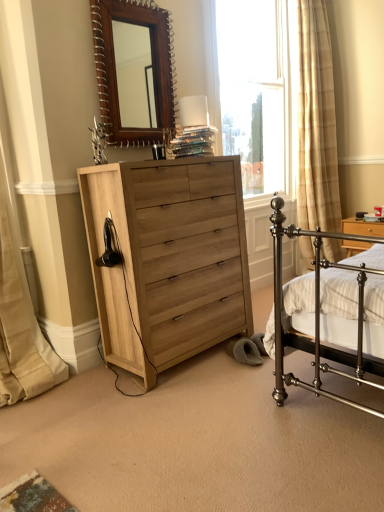
Question: Is wooden mirror at upper center not near beige fabric curtain at left?

Choices:
 (A) no
 (B) yes

Answer: (B)

Question: Considering the relative sizes of wooden mirror at upper center and beige fabric curtain at left in the image provided, is wooden mirror at upper center thinner than beige fabric curtain at left?

Choices:
 (A) no
 (B) yes

Answer: (B)

Question: Is wooden mirror at upper center surrounding beige fabric curtain at left?

Choices:
 (A) yes
 (B) no

Answer: (B)

Question: From a real-world perspective, is wooden mirror at upper center on beige fabric curtain at left?

Choices:
 (A) yes
 (B) no

Answer: (A)

Question: Considering the relative sizes of wooden mirror at upper center and beige fabric curtain at left in the image provided, is wooden mirror at upper center wider than beige fabric curtain at left?

Choices:
 (A) yes
 (B) no

Answer: (B)

Question: In the image, is wooden mirror at upper center positioned in front of or behind beige fabric curtain at left?

Choices:
 (A) behind
 (B) front

Answer: (A)

Question: In terms of size, does wooden mirror at upper center appear bigger or smaller than beige fabric curtain at left?

Choices:
 (A) big
 (B) small

Answer: (B)

Question: From the image's perspective, is wooden mirror at upper center above or below beige fabric curtain at left?

Choices:
 (A) below
 (B) above

Answer: (B)

Question: Looking at their shapes, would you say wooden mirror at upper center is wider or thinner than beige fabric curtain at left?

Choices:
 (A) wide
 (B) thin

Answer: (B)

Question: Does point (34, 343) appear closer or farther from the camera than point (104, 90)?

Choices:
 (A) farther
 (B) closer

Answer: (A)

Question: Is beige fabric curtain at left situated inside wooden mirror at upper center or outside?

Choices:
 (A) inside
 (B) outside

Answer: (B)

Question: From the image's perspective, is beige fabric curtain at left positioned above or below wooden mirror at upper center?

Choices:
 (A) below
 (B) above

Answer: (A)

Question: Based on their sizes in the image, would you say beige fabric curtain at left is bigger or smaller than wooden mirror at upper center?

Choices:
 (A) small
 (B) big

Answer: (B)

Question: Considering the positions of beige fabric curtain at left and white glossy table lamp at upper center in the image, is beige fabric curtain at left taller or shorter than white glossy table lamp at upper center?

Choices:
 (A) tall
 (B) short

Answer: (A)

Question: Based on their positions, is beige fabric curtain at left located to the left or right of white glossy table lamp at upper center?

Choices:
 (A) right
 (B) left

Answer: (B)